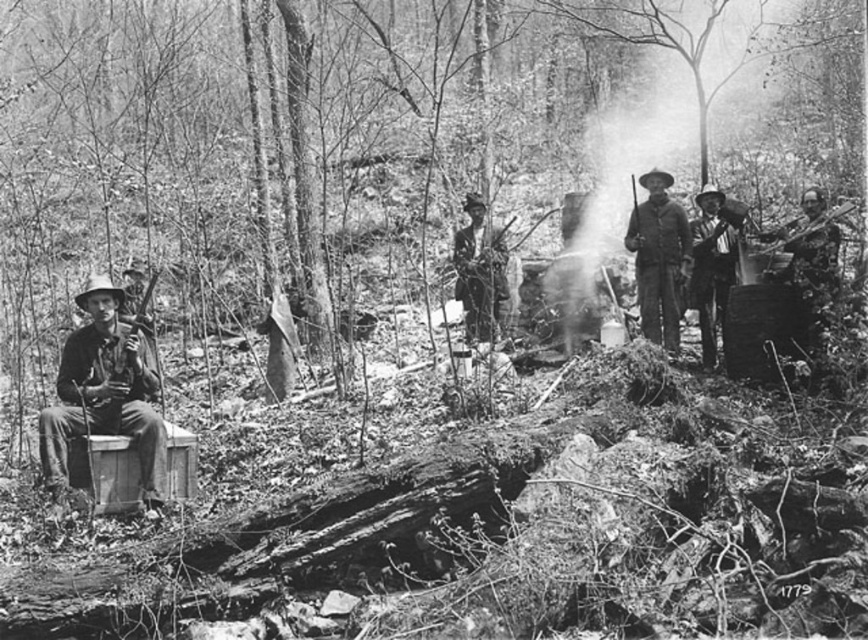
Question: Which is farther from the smooth leather hat at center?

Choices:
 (A) matte wooden bucket at left
 (B) rusty metal rifle at center
 (C) rugged leather jacket at center

Answer: (A)

Question: Is rugged leather jacket at center thinner than smooth leather hat at center?

Choices:
 (A) no
 (B) yes

Answer: (A)

Question: Which object is farther from the camera taking this photo?

Choices:
 (A) rusty metal rifle at center
 (B) matte wooden bucket at left
 (C) rugged leather jacket at center
 (D) smooth leather hat at center

Answer: (C)

Question: Which object is closer to the camera taking this photo?

Choices:
 (A) rusty metal rifle at center
 (B) rugged leather jacket at center
 (C) matte wooden bucket at left

Answer: (C)

Question: Is rugged leather jacket at center positioned at the back of smooth leather hat at center?

Choices:
 (A) no
 (B) yes

Answer: (B)

Question: Is matte wooden bucket at left further to camera compared to rusty metal rifle at center?

Choices:
 (A) yes
 (B) no

Answer: (B)